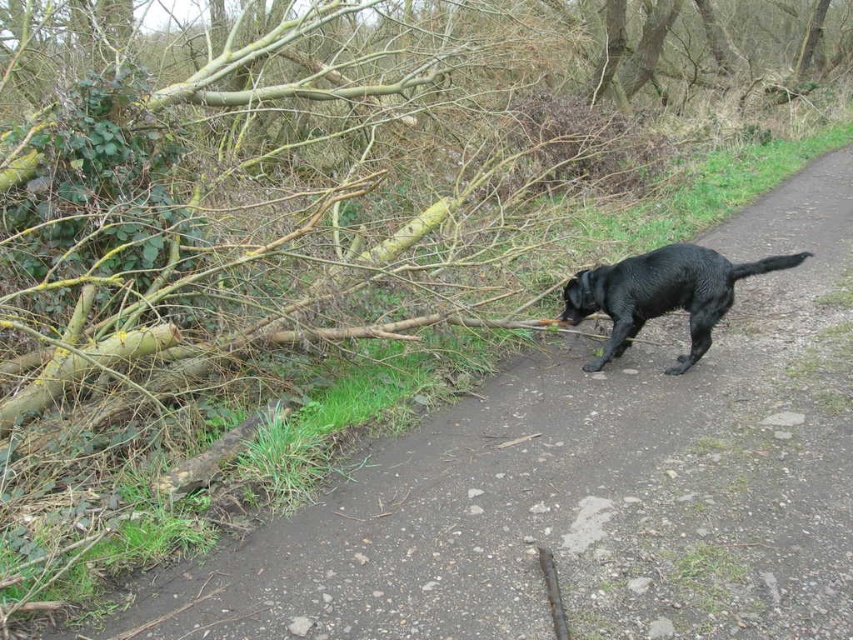
In the scene shown: You are a hiker who wants to place a small backpack on the brown wood log at left. Can you do that?

Yes, you can place the small backpack on the brown wood log at left because it is a solid surface and the coordinates indicate it is accessible.